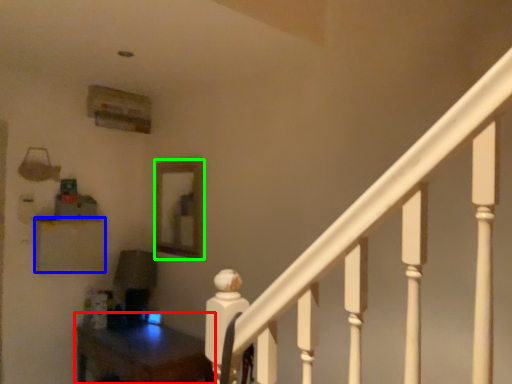
Question: Estimate the real-world distances between objects in this image. Which object is closer to table (highlighted by a red box), furniture (highlighted by a blue box) or mirror (highlighted by a green box)?

Choices:
 (A) furniture
 (B) mirror

Answer: (A)